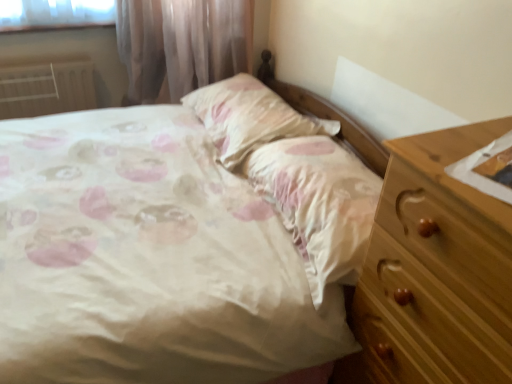
Question: Are white painted metal radiator at left and pink satin sheet at center making contact?

Choices:
 (A) no
 (B) yes

Answer: (A)

Question: From the image's perspective, is white painted metal radiator at left over pink satin sheet at center?

Choices:
 (A) yes
 (B) no

Answer: (A)

Question: From a real-world perspective, is white painted metal radiator at left below pink satin sheet at center?

Choices:
 (A) no
 (B) yes

Answer: (B)

Question: From a real-world perspective, is white painted metal radiator at left over pink satin sheet at center?

Choices:
 (A) yes
 (B) no

Answer: (B)

Question: Is white painted metal radiator at left outside of pink satin sheet at center?

Choices:
 (A) no
 (B) yes

Answer: (B)

Question: From the image's perspective, is white painted metal radiator at left below pink satin sheet at center?

Choices:
 (A) no
 (B) yes

Answer: (A)

Question: Does satin floral pillow at center have a smaller size compared to pink satin sheet at center?

Choices:
 (A) no
 (B) yes

Answer: (B)

Question: Is satin floral pillow at center to the right of pink satin sheet at center from the viewer's perspective?

Choices:
 (A) no
 (B) yes

Answer: (A)

Question: Is satin floral pillow at center bigger than pink satin sheet at center?

Choices:
 (A) no
 (B) yes

Answer: (A)

Question: Is satin floral pillow at center oriented towards pink satin sheet at center?

Choices:
 (A) yes
 (B) no

Answer: (B)

Question: From the image's perspective, is satin floral pillow at center under pink satin sheet at center?

Choices:
 (A) yes
 (B) no

Answer: (B)

Question: Is satin floral pillow at center at the left side of pink satin sheet at center?

Choices:
 (A) no
 (B) yes

Answer: (B)

Question: Is white painted metal radiator at left facing towards satin floral pillow at center?

Choices:
 (A) yes
 (B) no

Answer: (B)